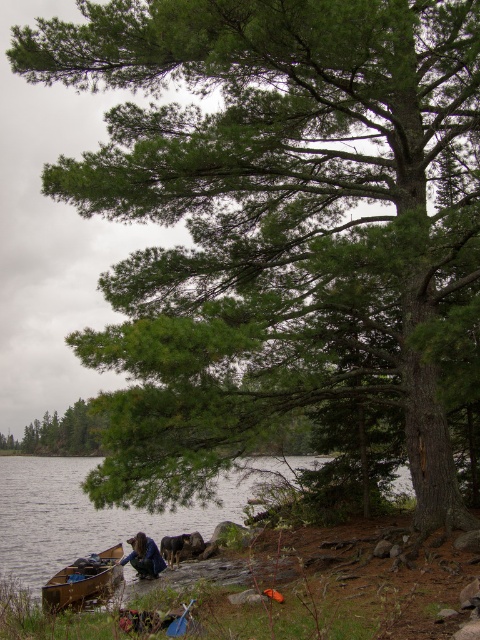
Question: Which object is the farthest from the green matte tree at center?

Choices:
 (A) wooden canoe at lower left
 (B) dark blue fabric at lower center

Answer: (B)

Question: Considering the relative positions of green matte tree at center and dark blue fabric at lower center in the image provided, where is green matte tree at center located with respect to dark blue fabric at lower center?

Choices:
 (A) right
 (B) left

Answer: (B)

Question: Can you confirm if green matte tree at center is positioned to the right of dark blue fabric at lower center?

Choices:
 (A) yes
 (B) no

Answer: (B)

Question: Which of the following is the closest to the observer?

Choices:
 (A) (133, 550)
 (B) (71, 582)
 (C) (81, 435)

Answer: (B)

Question: Observing the image, what is the correct spatial positioning of wooden canoe at lower left in reference to dark blue fabric at lower center?

Choices:
 (A) below
 (B) above

Answer: (A)

Question: Based on their relative distances, which object is farther from the dark blue fabric at lower center?

Choices:
 (A) wooden canoe at lower left
 (B) green matte tree at center

Answer: (B)